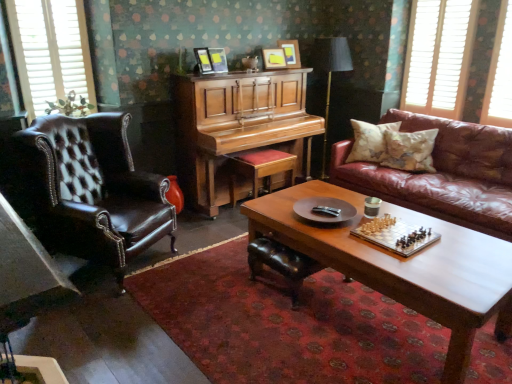
Identify the location of vacant space to the right of metallic chess set at center. (459, 245).